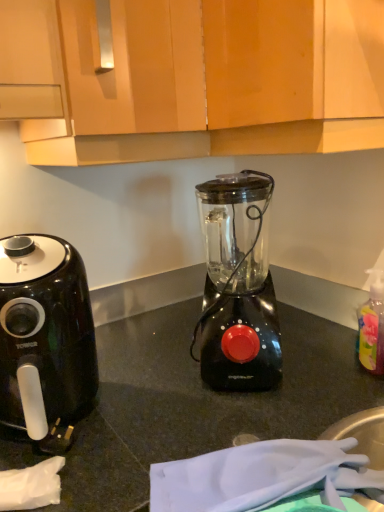
Question: Would you consider translucent plastic bottle at right to be distant from black plastic air fryer at left?

Choices:
 (A) no
 (B) yes

Answer: (A)

Question: From a real-world perspective, does translucent plastic bottle at right stand above black plastic air fryer at left?

Choices:
 (A) no
 (B) yes

Answer: (A)

Question: Considering the relative positions of translucent plastic bottle at right and black plastic air fryer at left in the image provided, is translucent plastic bottle at right to the left of black plastic air fryer at left from the viewer's perspective?

Choices:
 (A) no
 (B) yes

Answer: (A)

Question: Can you confirm if translucent plastic bottle at right is wider than black plastic air fryer at left?

Choices:
 (A) yes
 (B) no

Answer: (B)

Question: Is translucent plastic bottle at right facing away from black plastic air fryer at left?

Choices:
 (A) no
 (B) yes

Answer: (A)

Question: Do you think translucent plastic bottle at right is within black plastic blender at center, or outside of it?

Choices:
 (A) outside
 (B) inside

Answer: (A)

Question: From the image's perspective, relative to black plastic blender at center, is translucent plastic bottle at right above or below?

Choices:
 (A) above
 (B) below

Answer: (B)

Question: Is translucent plastic bottle at right in front of or behind black plastic blender at center in the image?

Choices:
 (A) front
 (B) behind

Answer: (B)

Question: Would you say translucent plastic bottle at right is to the left or to the right of black plastic blender at center in the picture?

Choices:
 (A) left
 (B) right

Answer: (B)

Question: Considering the positions of wooden cabinet at upper center and black plastic blender at center in the image, is wooden cabinet at upper center bigger or smaller than black plastic blender at center?

Choices:
 (A) big
 (B) small

Answer: (A)

Question: In terms of height, does wooden cabinet at upper center look taller or shorter compared to black plastic blender at center?

Choices:
 (A) tall
 (B) short

Answer: (A)

Question: Considering the relative positions of wooden cabinet at upper center and black plastic blender at center in the image provided, is wooden cabinet at upper center to the left or to the right of black plastic blender at center?

Choices:
 (A) right
 (B) left

Answer: (B)

Question: Does point (132, 114) appear closer or farther from the camera than point (221, 232)?

Choices:
 (A) closer
 (B) farther

Answer: (A)

Question: From the image's perspective, relative to wooden cabinet at upper center, is black plastic blender at center above or below?

Choices:
 (A) below
 (B) above

Answer: (A)

Question: Considering the positions of black plastic blender at center and wooden cabinet at upper center in the image, is black plastic blender at center wider or thinner than wooden cabinet at upper center?

Choices:
 (A) wide
 (B) thin

Answer: (B)